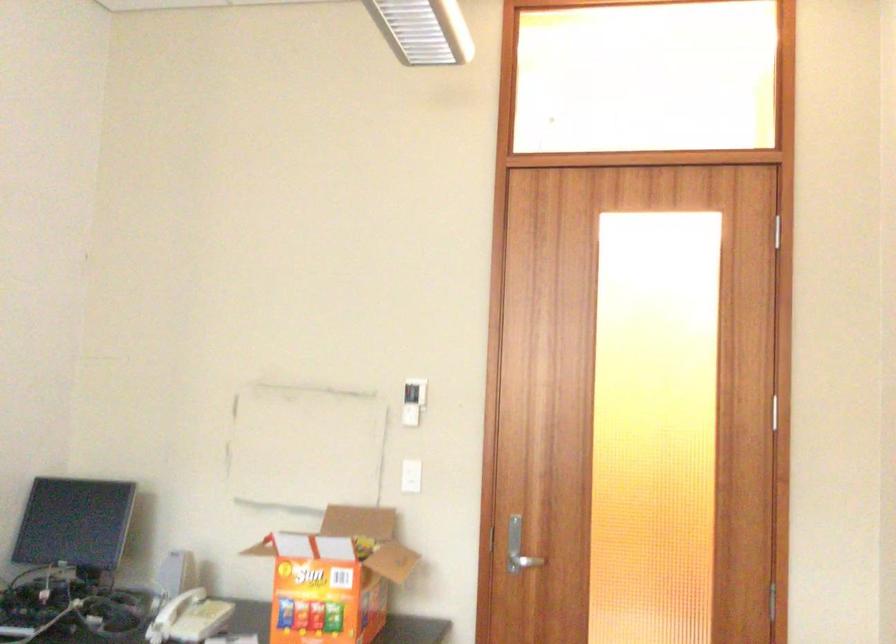
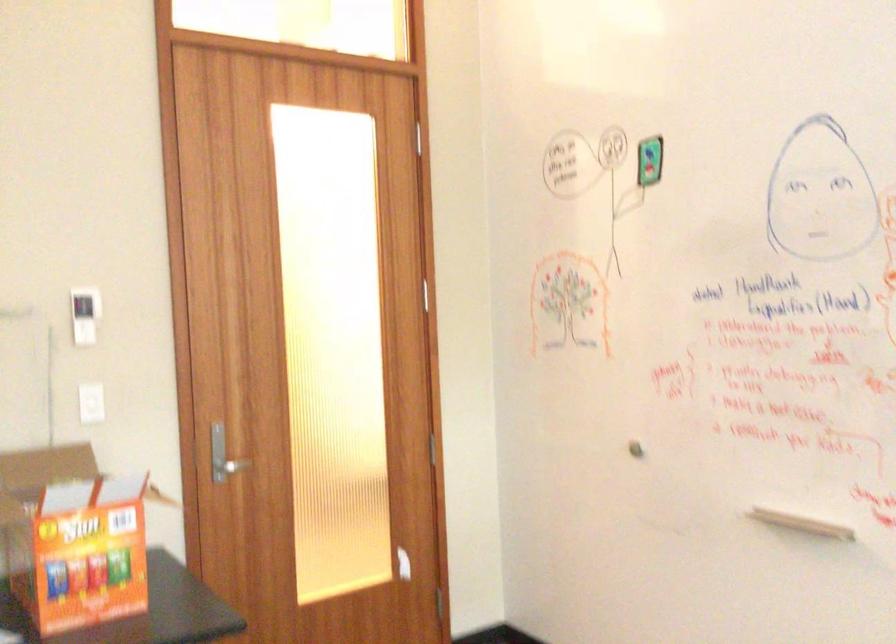
Locate, in the second image, the point that corresponds to [410,402] in the first image.

(84, 315)